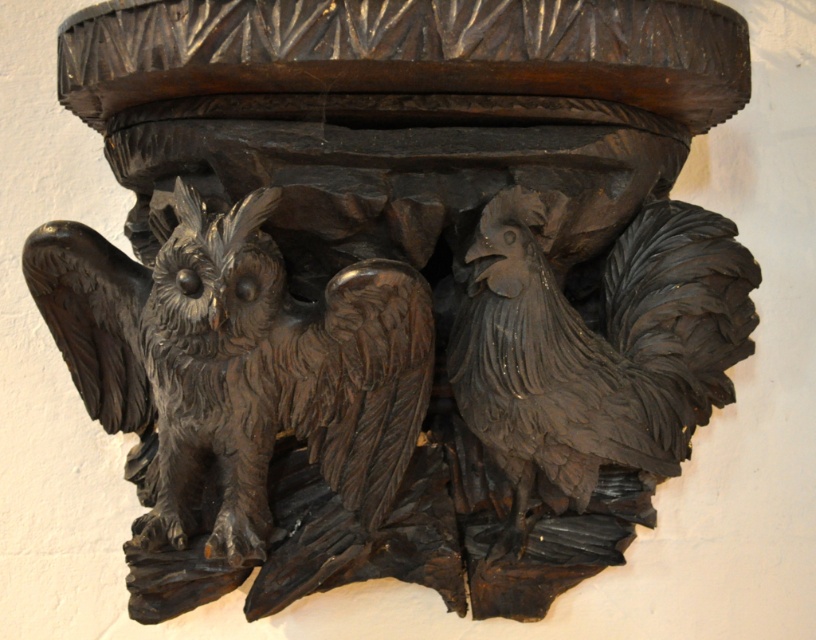
You are an architect examining a detailed wooden carving. You see the dark brown wood owl at left. Can you determine its exact 2D coordinates within the image?

The dark brown wood owl at left is located at coordinates point (238, 362).

You are an architect examining the carved wooden piece. You need to determine which animal figure is taller between the dark brown wood owl at left and the dark wood rooster at right. Based on the carving details, which one is taller?

The dark brown wood owl at left is much taller than the dark wood rooster at right.